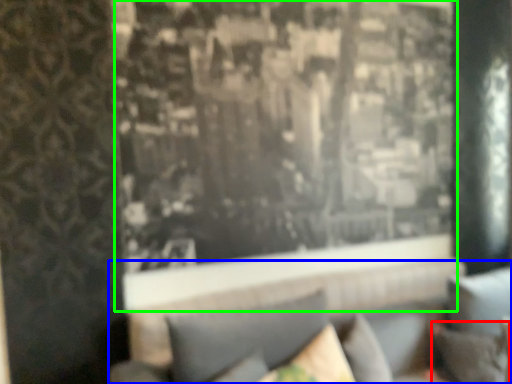
Question: Considering the real-world distances, which object is closest to pillow (highlighted by a red box)? couch (highlighted by a blue box) or window (highlighted by a green box).

Choices:
 (A) couch
 (B) window

Answer: (A)